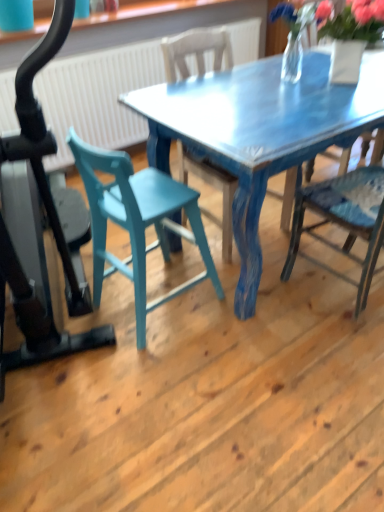
Question: In the image, is blue painted wood chair at center, which is the 2th chair in left-to-right order, positioned in front of or behind blue painted wood chair at right, the third chair positioned from the left?

Choices:
 (A) behind
 (B) front

Answer: (A)

Question: Is blue painted wood chair at center, which is the 2th chair in left-to-right order, to the left or to the right of blue painted wood chair at right, the third chair positioned from the left, in the image?

Choices:
 (A) left
 (B) right

Answer: (A)

Question: Based on their relative distances, which object is nearer to the blue painted wood chair at right, the third chair positioned from the left?

Choices:
 (A) teal wood chair at center, which appears as the first chair when viewed from the left
 (B) blue painted wood chair at center, which is the 2th chair in left-to-right order

Answer: (A)

Question: Which object is the closest to the blue painted wood chair at center, which is the 2th chair in left-to-right order?

Choices:
 (A) teal wood chair at center, which appears as the first chair when viewed from the left
 (B) blue painted wood chair at right, the third chair positioned from the left

Answer: (A)